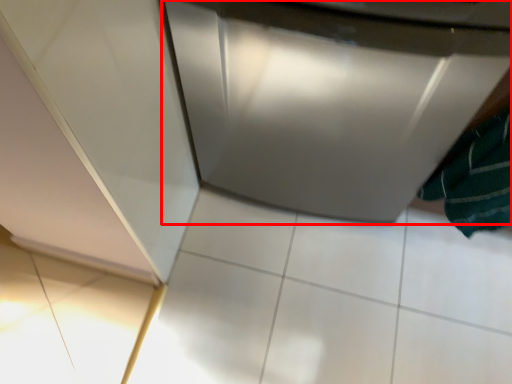
Question: From the image's perspective, where is home appliance (annotated by the red box) located in relation to bath towel in the image?

Choices:
 (A) above
 (B) below

Answer: (A)